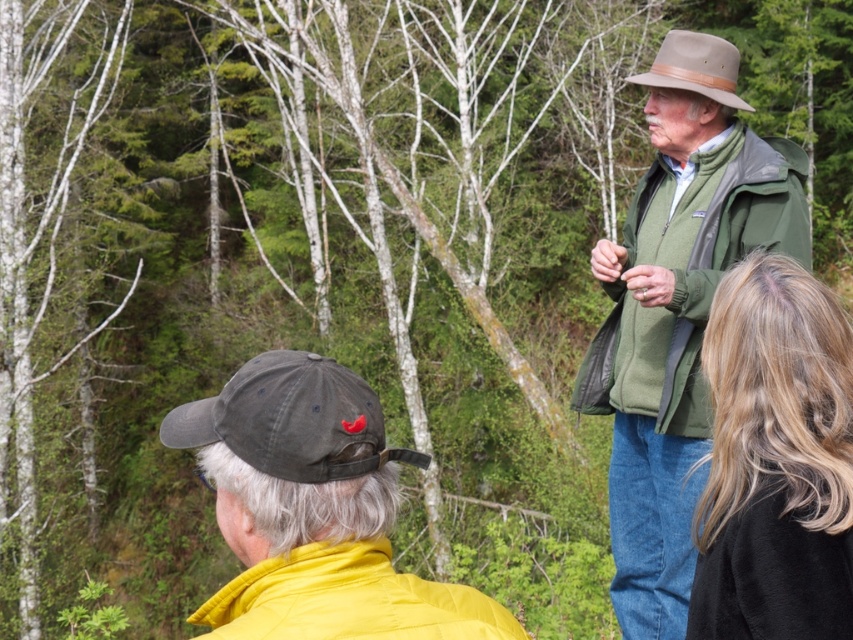
You are a photographer trying to capture a candid shot of the blonde hair at center and the yellow quilted jacket at lower left. To ensure both subjects are in frame, should you adjust your camera to focus more to the left or the right?

Since the blonde hair at center is to the right of the yellow quilted jacket at lower left, you should adjust your camera to focus more to the right to include both subjects in the frame.

You are standing in the forest scene and want to determine which of the two points, point (358, 548) or point (762, 234), is nearer to you. Based on the image, which point is closer?

Point (358, 548) is closer to the camera than point (762, 234), so it is the nearer one.